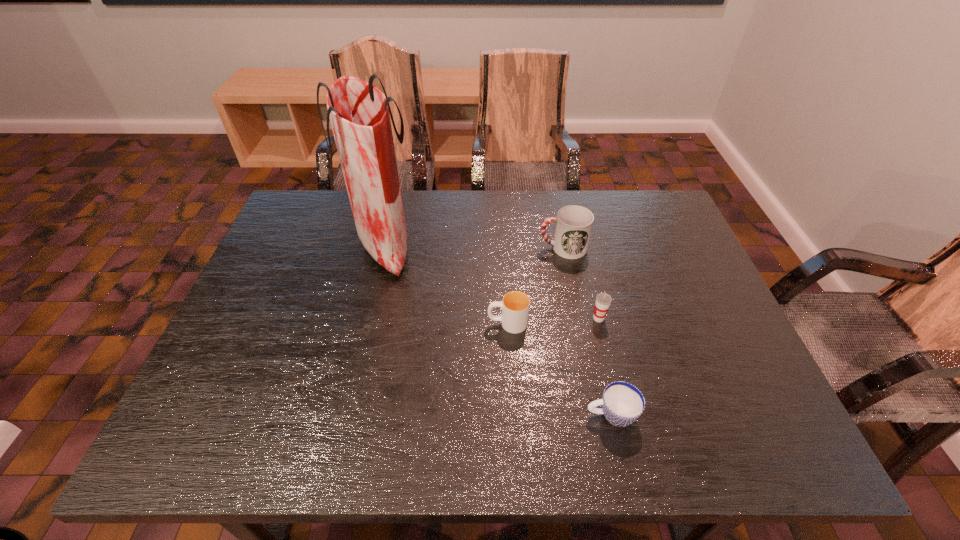
What are the coordinates of `vacant area situated 0.330m on the side of the farthest cup where the handle is located` in the screenshot? It's located at (424, 248).

Locate an element on the screen. vacant space located 0.300m with the handle on the side of the second shortest object is located at coordinates (365, 323).

The width and height of the screenshot is (960, 540). In order to click on vacant region located 0.280m with the handle on the side of the second shortest object in this screenshot , I will do `click(372, 323)`.

The image size is (960, 540). Find the location of `free space located with the handle on the side of the second shortest object`. free space located with the handle on the side of the second shortest object is located at coordinates (340, 323).

Locate an element on the screen. free location located on the side of the shortest cup with the handle is located at coordinates (391, 415).

Identify the location of vacant space located 0.310m on the side of the shortest cup with the handle. The image size is (960, 540). (435, 415).

Locate an element on the screen. vacant region located on the side of the shortest cup with the handle is located at coordinates (546, 415).

Identify the location of grocery bag that is at the far edge. (359, 112).

Identify the location of cup that is at the far edge. (574, 223).

Find the location of a particular element. The height and width of the screenshot is (540, 960). object that is at the near edge is located at coordinates (622, 403).